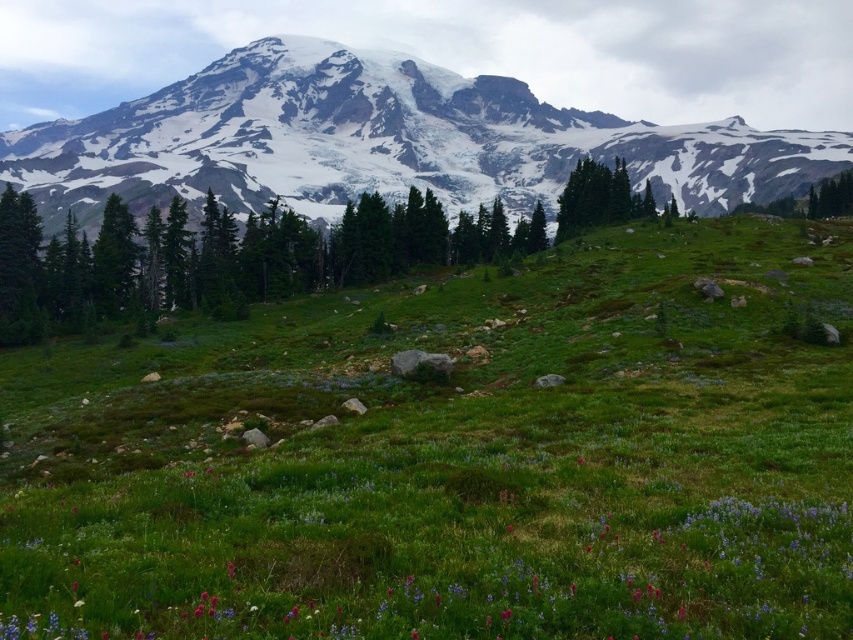
You are standing in the mountain landscape and want to take a photo of both the green grassy field at center and the snowy granite mountain at upper center. Which object should you adjust your camera to focus on first if you want both to be in the frame?

The green grassy field at center is positioned on the right side of snowy granite mountain at upper center, so you should focus on the snowy granite mountain at upper center first to ensure both are in the frame.

You are standing at the origin point in the image and want to reach the green grassy field at center. Which direction should you move in to get there?

Since the green grassy field at center is located at point 0.719 on the x axis and 0.535 on the y axis, you should move to the right and slightly forward to reach it.